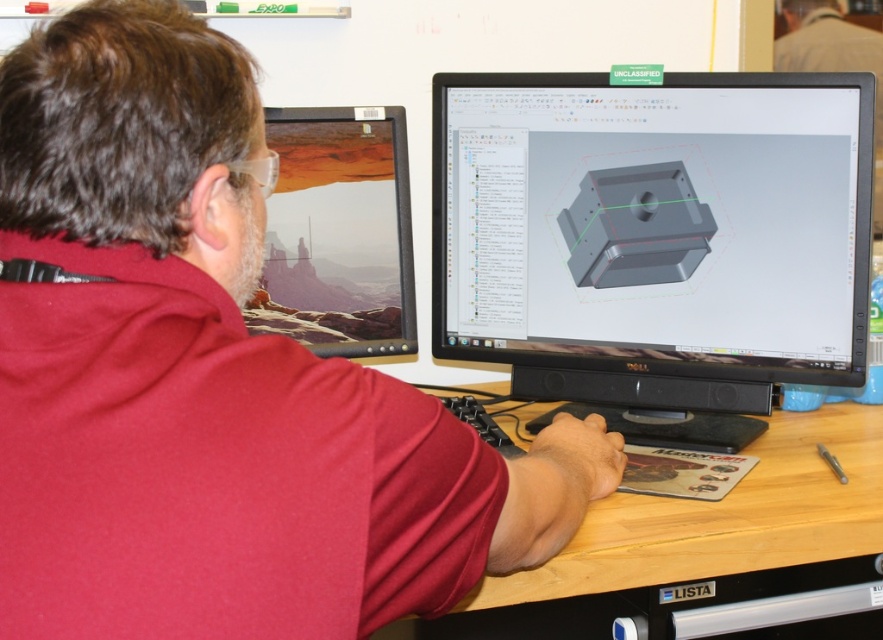
Question: Estimate the real-world distances between objects in this image. Which object is closer to the light brown wood at center?

Choices:
 (A) red matte shirt at center
 (B) matte black monitor at center

Answer: (B)

Question: Can you confirm if red matte shirt at center is positioned to the left of matte black monitor at center?

Choices:
 (A) yes
 (B) no

Answer: (A)

Question: Which point appears closest to the camera in this image?

Choices:
 (A) (717, 170)
 (B) (88, 592)
 (C) (297, 125)
 (D) (451, 392)

Answer: (B)

Question: Is red matte shirt at center positioned behind matte black monitor at center?

Choices:
 (A) no
 (B) yes

Answer: (A)

Question: Where is matte black monitor at center located in relation to matte black monitor at left in the image?

Choices:
 (A) left
 (B) right

Answer: (B)

Question: Estimate the real-world distances between objects in this image. Which object is farther from the red matte shirt at center?

Choices:
 (A) light brown wood at center
 (B) matte black monitor at left

Answer: (B)